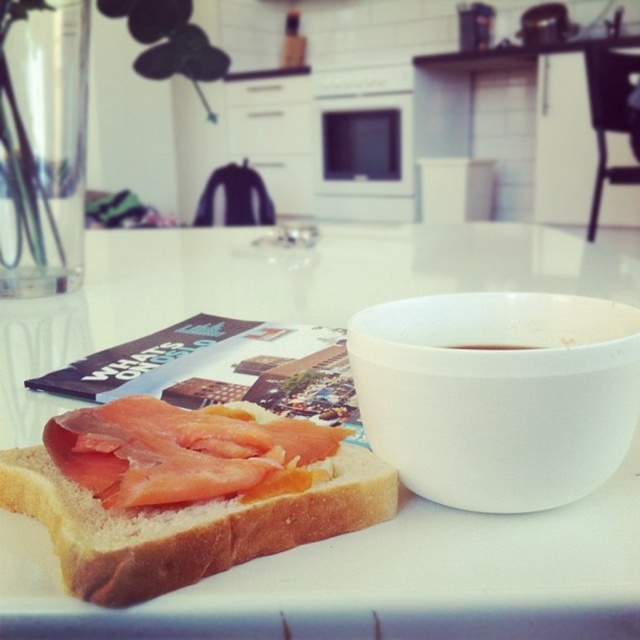
Question: Is pinkish salmon at center positioned before white matte bowl at upper right?

Choices:
 (A) no
 (B) yes

Answer: (B)

Question: Which point is farther to the camera?

Choices:
 (A) (464, 333)
 (B) (451, 346)

Answer: (B)

Question: Does white glossy table at center have a smaller size compared to brown matte bowl at right?

Choices:
 (A) yes
 (B) no

Answer: (B)

Question: Is white glossy table at center further to the viewer compared to white matte bowl at upper right?

Choices:
 (A) no
 (B) yes

Answer: (A)

Question: Which point is farther to the camera?

Choices:
 (A) white matte bowl at upper right
 (B) pinkish salmon at center

Answer: (A)

Question: Which point appears closest to the camera in this image?

Choices:
 (A) (529, 472)
 (B) (376, 468)

Answer: (A)